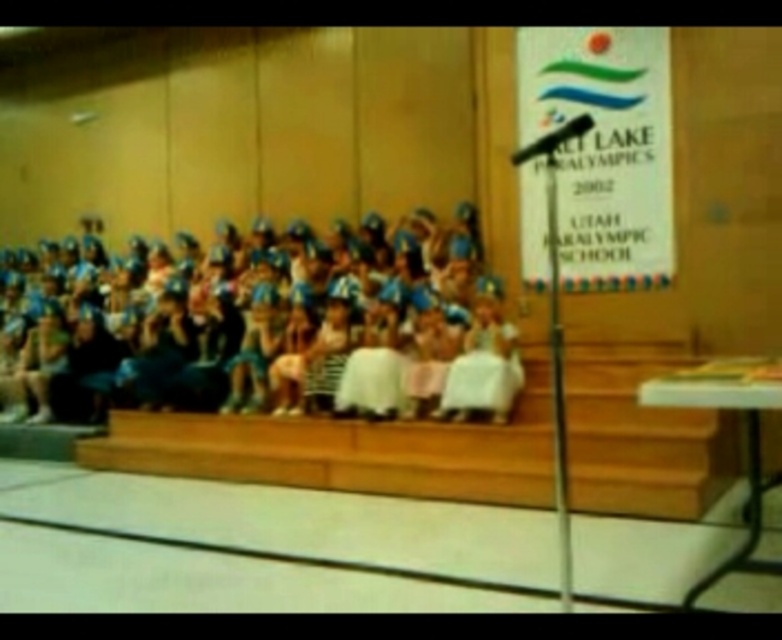
Who is shorter, blue fabric dress at center or wooden stairs at center?

wooden stairs at center is shorter.

What do you see at coordinates (224, 316) in the screenshot? I see `blue fabric dress at center` at bounding box center [224, 316].

Image resolution: width=782 pixels, height=640 pixels. Find the location of `blue fabric dress at center`. blue fabric dress at center is located at coordinates (224, 316).